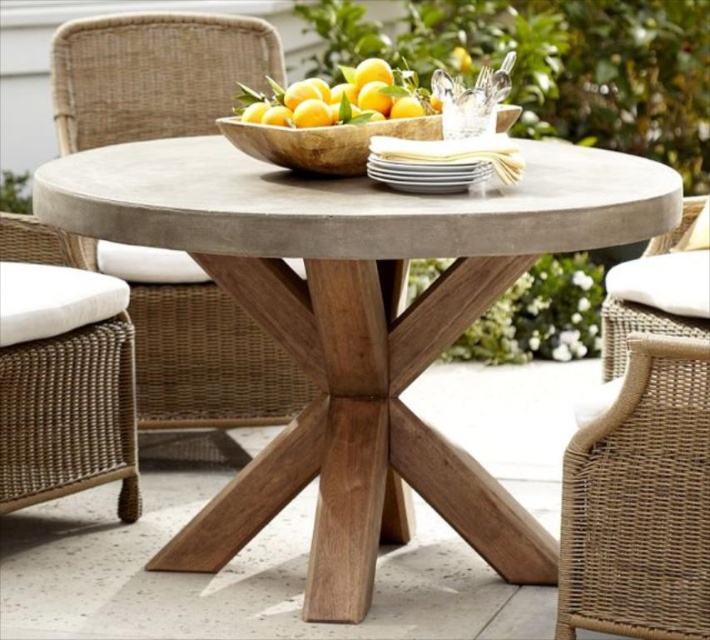
Describe the element at coordinates (153, 74) in the screenshot. This screenshot has height=640, width=710. I see `woven rattan chair at center` at that location.

Between woven rattan chair at center and woven rattan chair with white cushion at lower left, which one has more height?

Standing taller between the two is woven rattan chair with white cushion at lower left.

Is point (231, 413) positioned before point (6, 490)?

That is False.

The width and height of the screenshot is (710, 640). Identify the location of woven rattan chair at center. (153, 74).

Which is behind, point (173, 544) or point (248, 88)?

Positioned behind is point (248, 88).

Is matte concrete table at center to the left of yellow matte/orange textured bowl at upper center from the viewer's perspective?

No, matte concrete table at center is not to the left of yellow matte/orange textured bowl at upper center.

Is point (155, 216) behind point (390, 109)?

No, it is in front of (390, 109).

At what (x,y) coordinates should I click in order to perform the action: click on matte concrete table at center. Please return your answer as a coordinate pair (x, y). The image size is (710, 640). Looking at the image, I should click on (356, 326).

Between woven rattan chair at center and yellow matte/orange textured bowl at upper center, which one is positioned higher?

woven rattan chair at center is above.

Who is positioned more to the left, woven rattan chair at center or yellow matte/orange textured bowl at upper center?

woven rattan chair at center is more to the left.

Measure the distance between point [60,106] and camera.

A distance of 3.85 meters exists between point [60,106] and camera.

What are the coordinates of `woven rattan chair at center` in the screenshot? It's located at (153, 74).